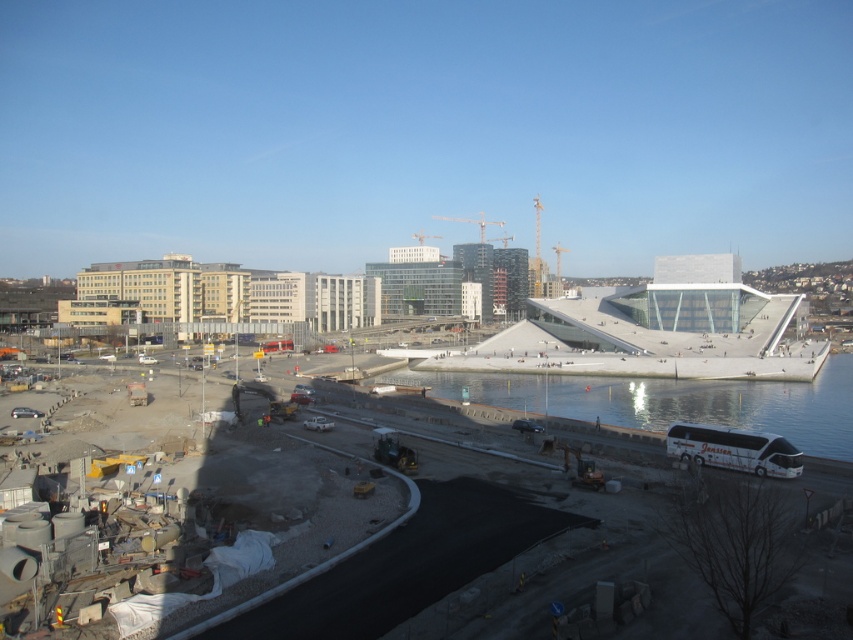
Question: Is clear glass waterway at lower center thinner than concrete construction site at lower left?

Choices:
 (A) no
 (B) yes

Answer: (A)

Question: Does clear glass waterway at lower center appear under concrete construction site at lower left?

Choices:
 (A) no
 (B) yes

Answer: (A)

Question: Which point is farther from the camera taking this photo?

Choices:
 (A) (254, 483)
 (B) (612, 394)

Answer: (B)

Question: Can you confirm if clear glass waterway at lower center is bigger than concrete construction site at lower left?

Choices:
 (A) no
 (B) yes

Answer: (A)